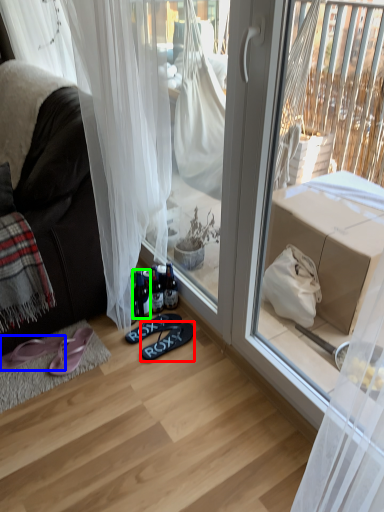
Question: Based on their relative distances, which object is farther from footwear (highlighted by a red box)? Choose from footwear (highlighted by a blue box) and bottle (highlighted by a green box).

Choices:
 (A) footwear
 (B) bottle

Answer: (A)